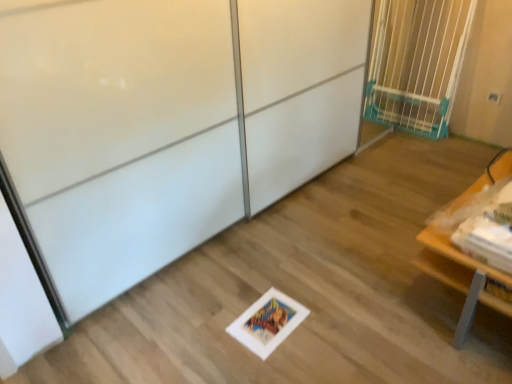
Find the location of a particular element. The height and width of the screenshot is (384, 512). vacant space positioned to the left of wooden table at lower right is located at coordinates (365, 311).